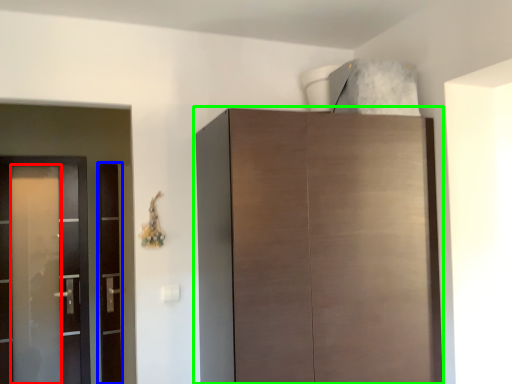
Question: Which is nearer to the screen door (highlighted by a red box)? screen door (highlighted by a blue box) or cupboard (highlighted by a green box).

Choices:
 (A) screen door
 (B) cupboard

Answer: (A)